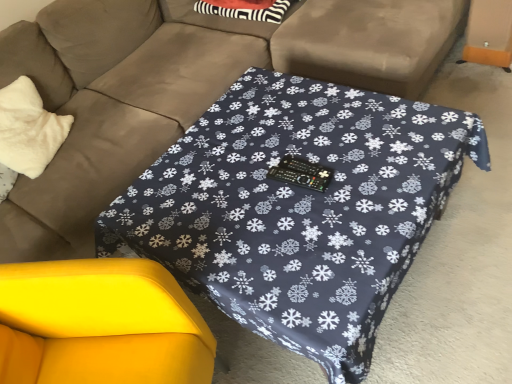
What is the approximate width of yellow fabric swivel chair at lower left?

yellow fabric swivel chair at lower left is 29.92 inches in width.

This screenshot has height=384, width=512. In order to click on dark blue fabric table at center in this screenshot , I will do `click(298, 209)`.

What's the angular difference between matte brown couch at center and yellow fabric swivel chair at lower left's facing directions?

The facing directions of matte brown couch at center and yellow fabric swivel chair at lower left are 29.1 degrees apart.

Does matte brown couch at center have a lesser width compared to yellow fabric swivel chair at lower left?

In fact, matte brown couch at center might be wider than yellow fabric swivel chair at lower left.

From the image's perspective, is matte brown couch at center located above or below yellow fabric swivel chair at lower left?

Based on their image positions, matte brown couch at center is located above yellow fabric swivel chair at lower left.

In the scene shown: From a real-world perspective, is matte brown couch at center positioned under yellow fabric swivel chair at lower left based on gravity?

No, from a real-world perspective, matte brown couch at center is not beneath yellow fabric swivel chair at lower left.

Can you tell me how much dark blue fabric table at center and matte brown couch at center differ in facing direction?

dark blue fabric table at center and matte brown couch at center are facing 0.000182 degrees away from each other.

From a real-world perspective, relative to matte brown couch at center, is dark blue fabric table at center vertically above or below?

dark blue fabric table at center is below matte brown couch at center.

This screenshot has height=384, width=512. I want to click on table lying behind the matte brown couch at center, so click(298, 209).

From the image's perspective, is dark blue fabric table at center positioned above or below matte brown couch at center?

Based on their image positions, dark blue fabric table at center is located beneath matte brown couch at center.

Which point is more forward, (194, 309) or (201, 173)?

Positioned in front is point (194, 309).

What's the angular difference between yellow fabric swivel chair at lower left and dark blue fabric table at center's facing directions?

They differ by 29.1 degrees in their facing directions.

From the image's perspective, is yellow fabric swivel chair at lower left under dark blue fabric table at center?

Indeed, from the image's perspective, yellow fabric swivel chair at lower left is shown beneath dark blue fabric table at center.

How different are the orientations of matte brown couch at center and white fluffy pillow at left in degrees?

The angle between the facing direction of matte brown couch at center and the facing direction of white fluffy pillow at left is 18.5 degrees.

Considering the relative sizes of matte brown couch at center and white fluffy pillow at left in the image provided, is matte brown couch at center smaller than white fluffy pillow at left?

No, matte brown couch at center is not smaller than white fluffy pillow at left.

From the image's perspective, is matte brown couch at center above white fluffy pillow at left?

Yes.

Between point (64, 68) and point (29, 79), which one is positioned behind?

The point (64, 68) is farther from the camera.

Is dark blue fabric table at center positioned far away from yellow fabric swivel chair at lower left?

No, dark blue fabric table at center is in close proximity to yellow fabric swivel chair at lower left.

Identify the location of swivel chair that is below the dark blue fabric table at center (from the image's perspective). [104, 323].

From a real-world perspective, is dark blue fabric table at center physically located above or below yellow fabric swivel chair at lower left?

From a real-world perspective, dark blue fabric table at center is physically below yellow fabric swivel chair at lower left.

In the scene shown: Can you tell me how much dark blue fabric table at center and yellow fabric swivel chair at lower left differ in facing direction?

29.1 degrees separate the facing orientations of dark blue fabric table at center and yellow fabric swivel chair at lower left.

From a real-world perspective, who is located higher, white fluffy pillow at left or yellow fabric swivel chair at lower left?

white fluffy pillow at left is physically above.

Which object is positioned more to the left, white fluffy pillow at left or yellow fabric swivel chair at lower left?

white fluffy pillow at left is more to the left.

Based on the photo, is white fluffy pillow at left inside the boundaries of yellow fabric swivel chair at lower left, or outside?

white fluffy pillow at left lies outside yellow fabric swivel chair at lower left.

Are yellow fabric swivel chair at lower left and matte brown couch at center beside each other?

They are not placed beside each other.

Is yellow fabric swivel chair at lower left spatially inside matte brown couch at center, or outside of it?

yellow fabric swivel chair at lower left exists entirely within matte brown couch at center.

Which is in front, point (30, 304) or point (226, 25)?

The point (30, 304) is more forward.

Where is `swivel chair located on the left of matte brown couch at center`? The image size is (512, 384). swivel chair located on the left of matte brown couch at center is located at coordinates (104, 323).

Locate an element on the screen. table that appears below the matte brown couch at center (from a real-world perspective) is located at coordinates (298, 209).

When comparing their distances from matte brown couch at center, does white fluffy pillow at left or yellow fabric swivel chair at lower left seem closer?

white fluffy pillow at left is positioned closer to the anchor matte brown couch at center.

Considering their positions, is matte brown couch at center positioned further to white fluffy pillow at left than yellow fabric swivel chair at lower left?

yellow fabric swivel chair at lower left is positioned further to the anchor white fluffy pillow at left.

When comparing their distances from matte brown couch at center, does dark blue fabric table at center or white fluffy pillow at left seem closer?

white fluffy pillow at left is positioned closer to the anchor matte brown couch at center.

From the image, which object appears to be nearer to matte brown couch at center, white fluffy pillow at left or dark blue fabric table at center?

Based on the image, white fluffy pillow at left appears to be nearer to matte brown couch at center.

Which object lies nearer to the anchor point white fluffy pillow at left, dark blue fabric table at center or yellow fabric swivel chair at lower left?

yellow fabric swivel chair at lower left.

Based on the photo, when comparing their distances from white fluffy pillow at left, does yellow fabric swivel chair at lower left or dark blue fabric table at center seem further?

dark blue fabric table at center is positioned further to the anchor white fluffy pillow at left.

When comparing their distances from yellow fabric swivel chair at lower left, does dark blue fabric table at center or white fluffy pillow at left seem further?

The object further to yellow fabric swivel chair at lower left is white fluffy pillow at left.

Which object lies further to the anchor point dark blue fabric table at center, matte brown couch at center or yellow fabric swivel chair at lower left?

matte brown couch at center.

The height and width of the screenshot is (384, 512). Find the location of `studio couch between white fluffy pillow at left and dark blue fabric table at center`. studio couch between white fluffy pillow at left and dark blue fabric table at center is located at coordinates (182, 87).

The height and width of the screenshot is (384, 512). I want to click on swivel chair situated between white fluffy pillow at left and dark blue fabric table at center from left to right, so click(104, 323).

At what (x,y) coordinates should I click in order to perform the action: click on throw pillow between matte brown couch at center and yellow fabric swivel chair at lower left in the vertical direction. Please return your answer as a coordinate pair (x, y). Looking at the image, I should click on (29, 129).

The image size is (512, 384). Identify the location of table that lies between matte brown couch at center and yellow fabric swivel chair at lower left from top to bottom. (298, 209).